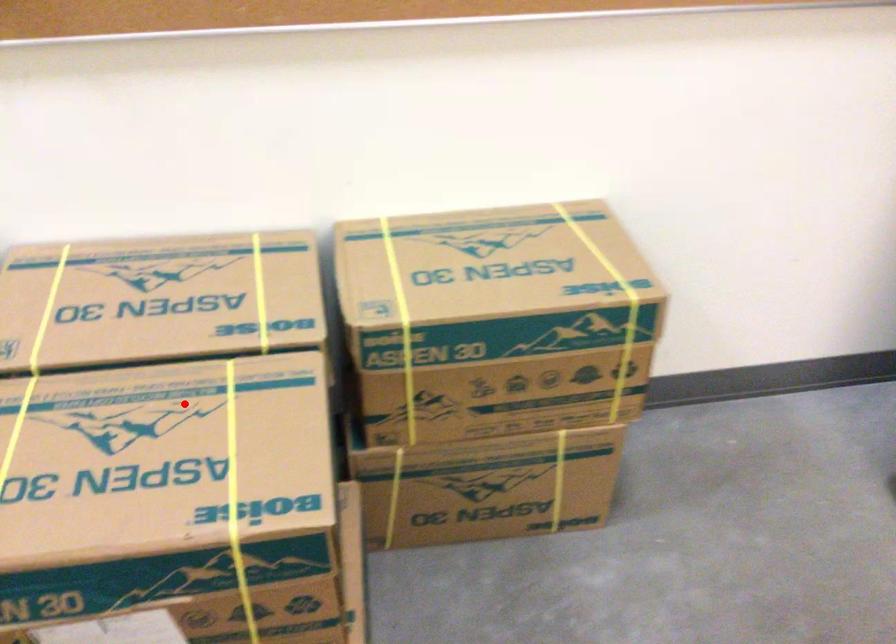
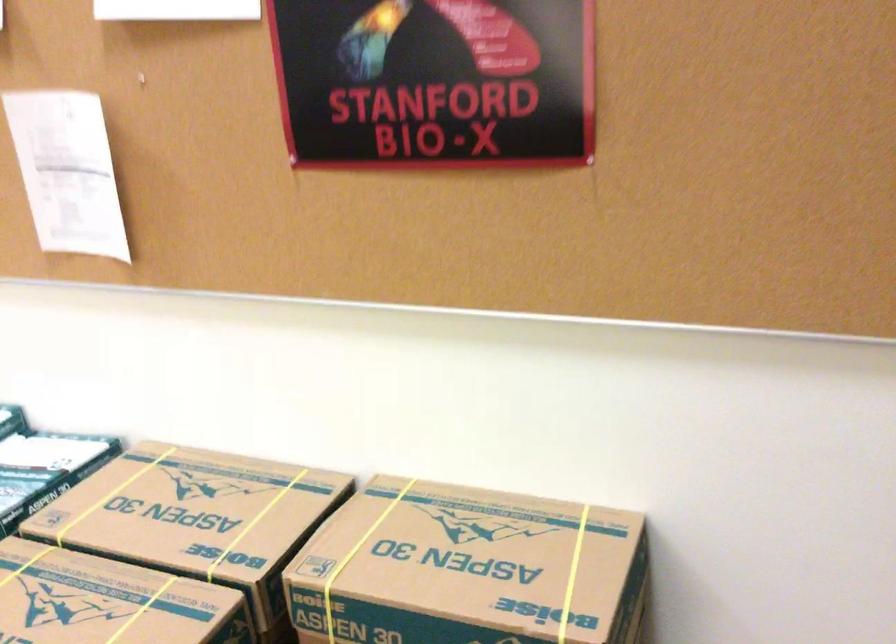
Question: I am providing you with two images of the same scene from different viewpoints. In image1, a red point is highlighted. Considering the same 3D point in image2, which of the following is correct?

Choices:
 (A) It is closer
 (B) It is farther

Answer: (B)